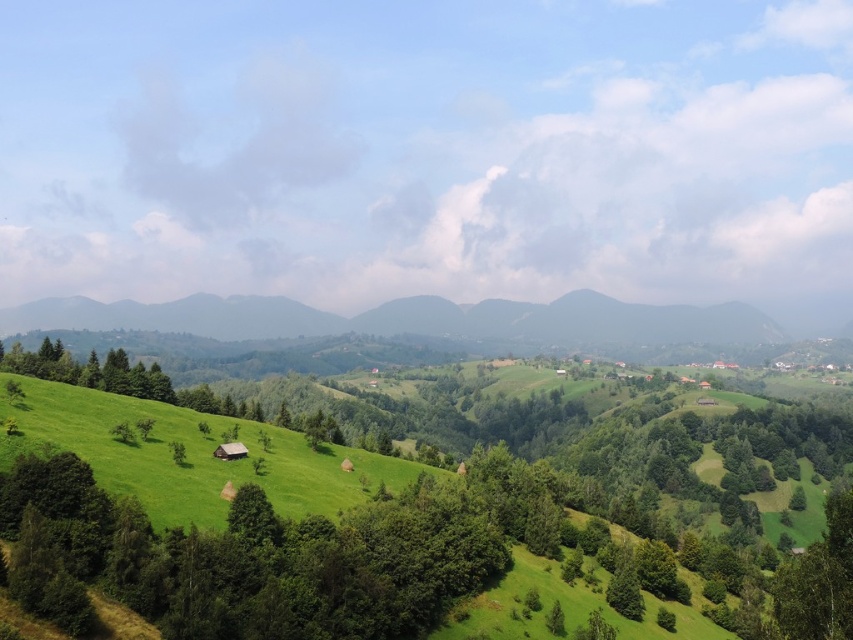
You are standing in the middle of the rural landscape and want to walk towards the green leafy tree at center and the green grassy field at lower left. Which one will you reach first?

You will reach the green leafy tree at center first because it is closer to the viewer than the green grassy field at lower left.